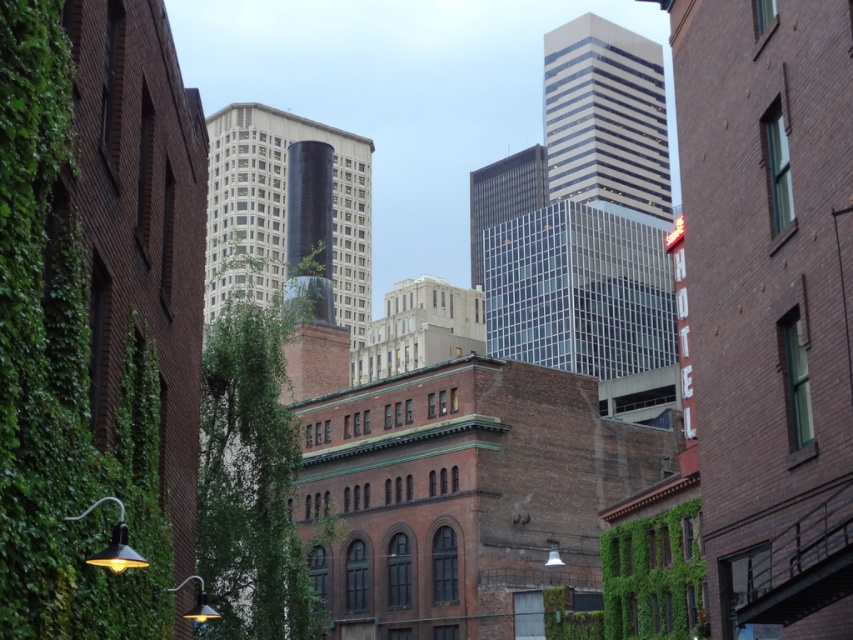
Is green ivy at left bigger than green leafy ivy at center?

Actually, green ivy at left might be smaller than green leafy ivy at center.

Between point (7, 371) and point (262, 532), which one is positioned behind?

Positioned behind is point (262, 532).

Is point (55, 189) in front of point (236, 582)?

Yes, point (55, 189) is in front of point (236, 582).

Where is `green ivy at left`? The height and width of the screenshot is (640, 853). green ivy at left is located at coordinates (62, 376).